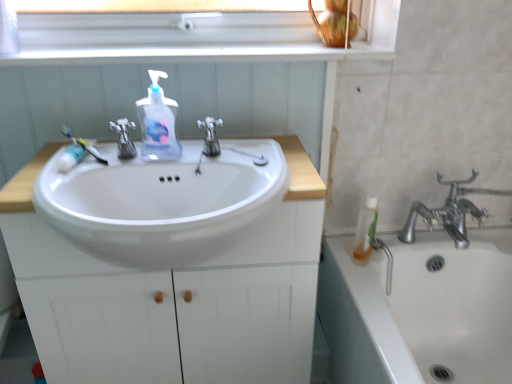
Question: From the image's perspective, does satin nickel faucet at center, acting as the first tap starting from the left, appear lower than white glossy window sill at upper center?

Choices:
 (A) yes
 (B) no

Answer: (A)

Question: Considering the relative sizes of satin nickel faucet at center, placed as the second tap when sorted from right to left, and white glossy window sill at upper center in the image provided, is satin nickel faucet at center, placed as the second tap when sorted from right to left, bigger than white glossy window sill at upper center?

Choices:
 (A) no
 (B) yes

Answer: (A)

Question: Is satin nickel faucet at center, placed as the second tap when sorted from right to left, surrounding white glossy window sill at upper center?

Choices:
 (A) yes
 (B) no

Answer: (B)

Question: From a real-world perspective, is satin nickel faucet at center, acting as the first tap starting from the left, physically above white glossy window sill at upper center?

Choices:
 (A) no
 (B) yes

Answer: (A)

Question: Is satin nickel faucet at center, placed as the second tap when sorted from right to left, at the left side of white glossy window sill at upper center?

Choices:
 (A) no
 (B) yes

Answer: (B)

Question: In terms of width, does translucent plastic bottle at right look wider or thinner when compared to white plastic toothbrush at left?

Choices:
 (A) thin
 (B) wide

Answer: (A)

Question: Considering the positions of translucent plastic bottle at right and white plastic toothbrush at left in the image, is translucent plastic bottle at right taller or shorter than white plastic toothbrush at left?

Choices:
 (A) short
 (B) tall

Answer: (B)

Question: Is translucent plastic bottle at right to the left or to the right of white plastic toothbrush at left in the image?

Choices:
 (A) right
 (B) left

Answer: (A)

Question: Considering the positions of point (361, 240) and point (89, 145), is point (361, 240) closer or farther from the camera than point (89, 145)?

Choices:
 (A) closer
 (B) farther

Answer: (B)

Question: Is white plastic toothbrush at left inside the boundaries of translucent plastic soap dispenser at center, or outside?

Choices:
 (A) inside
 (B) outside

Answer: (B)

Question: Considering the positions of point (74, 140) and point (158, 91), is point (74, 140) closer or farther from the camera than point (158, 91)?

Choices:
 (A) closer
 (B) farther

Answer: (B)

Question: Considering the relative positions of white plastic toothbrush at left and translucent plastic soap dispenser at center in the image provided, is white plastic toothbrush at left to the left or to the right of translucent plastic soap dispenser at center?

Choices:
 (A) left
 (B) right

Answer: (A)

Question: In terms of width, does white plastic toothbrush at left look wider or thinner when compared to translucent plastic soap dispenser at center?

Choices:
 (A) wide
 (B) thin

Answer: (A)

Question: From a real-world perspective, relative to satin nickel faucet at center, placed as the second tap when sorted from right to left, is translucent plastic bottle at right vertically above or below?

Choices:
 (A) below
 (B) above

Answer: (A)

Question: Is translucent plastic bottle at right in front of or behind satin nickel faucet at center, placed as the second tap when sorted from right to left, in the image?

Choices:
 (A) front
 (B) behind

Answer: (B)